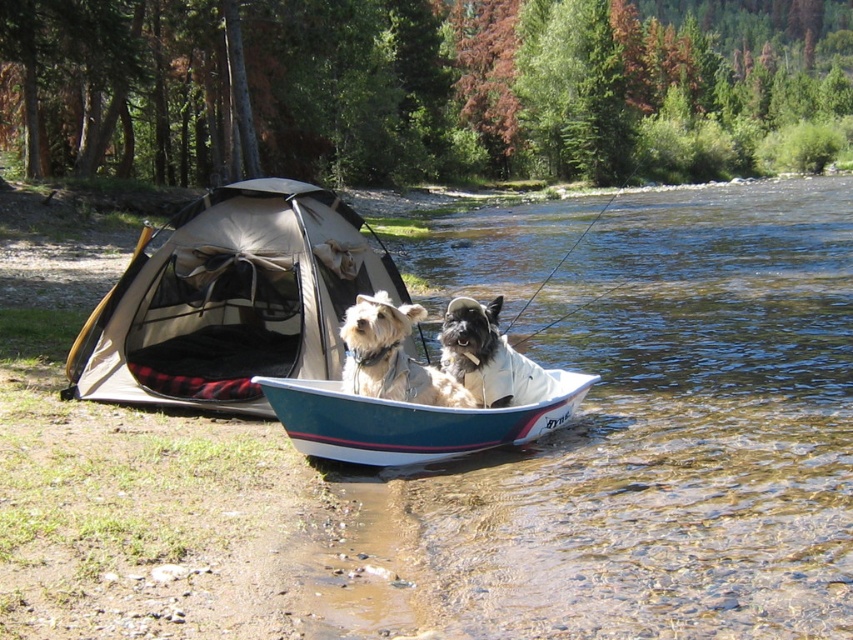
Question: Is beige canvas tent at left further to camera compared to white plastic canoe at center?

Choices:
 (A) yes
 (B) no

Answer: (A)

Question: Which object is positioned farthest from the light brown fur coat at center?

Choices:
 (A) white plastic canoe at center
 (B) beige canvas tent at left
 (C) white fur dog at center

Answer: (B)

Question: Which point appears farthest from the camera in this image?

Choices:
 (A) (207, 358)
 (B) (506, 369)
 (C) (335, 404)

Answer: (A)

Question: Which object is positioned closest to the light brown fur coat at center?

Choices:
 (A) white fur dog at center
 (B) white plastic canoe at center

Answer: (A)

Question: Is white plastic canoe at center further to camera compared to light brown fur coat at center?

Choices:
 (A) no
 (B) yes

Answer: (A)

Question: Where is white plastic canoe at center located in relation to white fur dog at center in the image?

Choices:
 (A) below
 (B) above

Answer: (A)